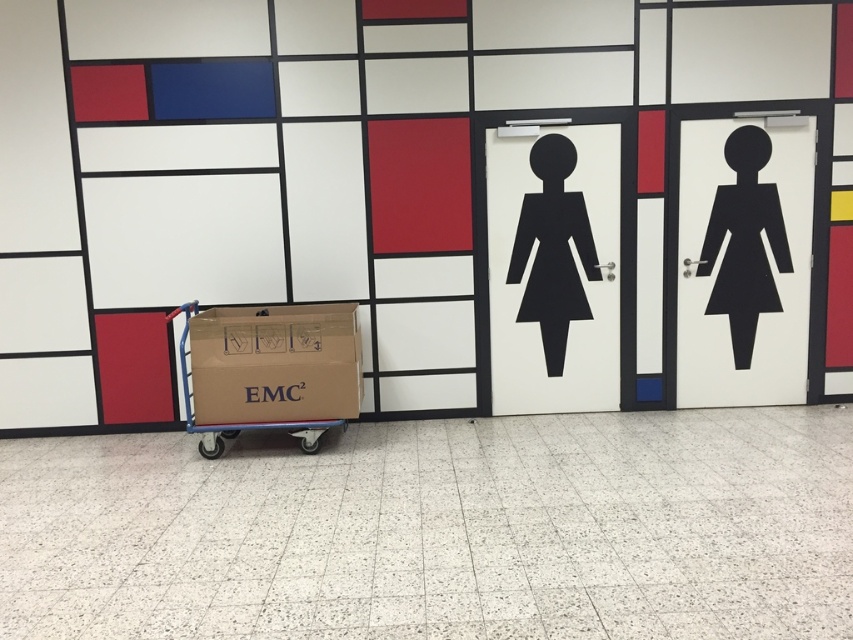
Who is shorter, black matte sign at right or black matte figure at center?

Standing shorter between the two is black matte figure at center.

Is black matte sign at right smaller than black matte figure at center?

No, black matte sign at right is not smaller than black matte figure at center.

Who is more forward, (724,157) or (544,330)?

Point (724,157) is in front.

Find the location of a particular element. black matte sign at right is located at coordinates (744, 243).

Does brown cardboard trolley at center come in front of black matte figure at center?

Yes, it is in front of black matte figure at center.

Which is more to the right, brown cardboard trolley at center or black matte figure at center?

From the viewer's perspective, black matte figure at center appears more on the right side.

Find the location of `brown cardboard trolley at center`. brown cardboard trolley at center is located at coordinates (270, 371).

The height and width of the screenshot is (640, 853). Find the location of `brown cardboard trolley at center`. brown cardboard trolley at center is located at coordinates [270, 371].

Is brown cardboard trolley at center above black matte sign at right?

Actually, brown cardboard trolley at center is below black matte sign at right.

Does point (300, 333) lie behind point (757, 211)?

No.

Find the location of `brown cardboard trolley at center`. brown cardboard trolley at center is located at coordinates pyautogui.click(x=270, y=371).